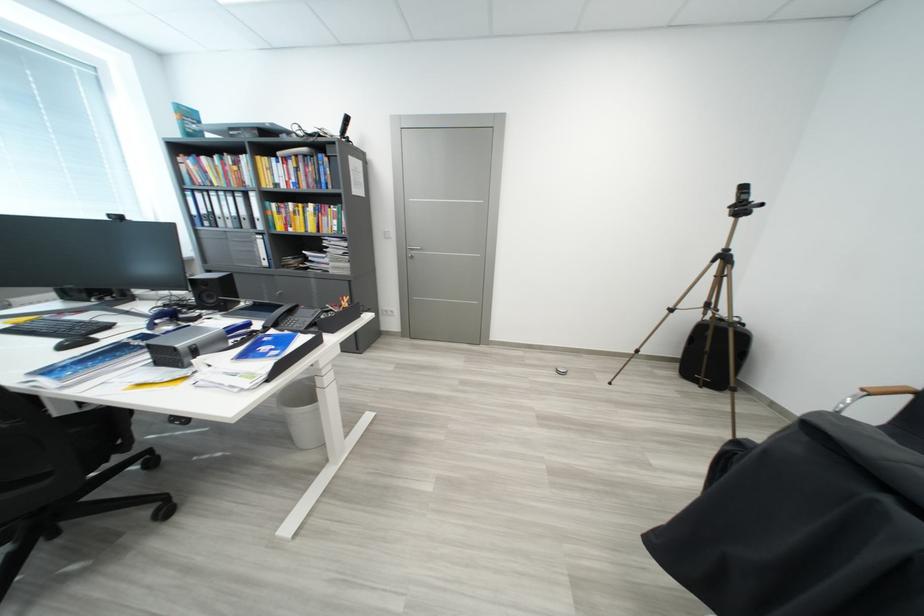
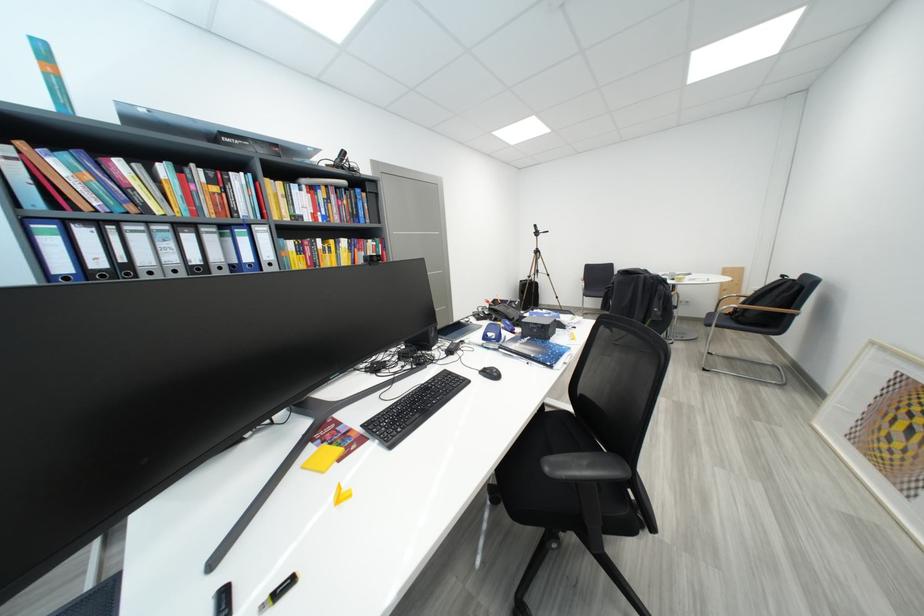
In the second image, find the point that corresponds to (x=262, y=131) in the first image.

(286, 148)